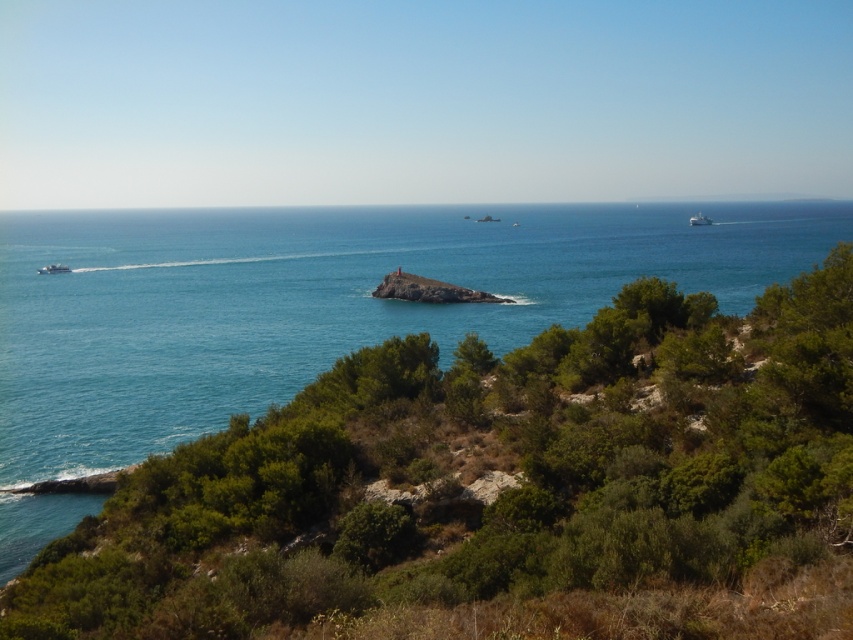
Between blue water at center and metallic silver boat at left, which one has less height?

metallic silver boat at left

Is blue water at center taller than metallic silver boat at left?

Yes.

Where is `blue water at center`? The height and width of the screenshot is (640, 853). blue water at center is located at coordinates (315, 301).

Is point (172, 234) closer to camera compared to point (699, 224)?

That is True.

Is blue water at center further to the viewer compared to white matte boat at upper right?

No, blue water at center is closer to the viewer.

At what (x,y) coordinates should I click in order to perform the action: click on blue water at center. Please return your answer as a coordinate pair (x, y). Looking at the image, I should click on (315, 301).

In order to click on blue water at center in this screenshot , I will do `click(315, 301)`.

Which is behind, point (42, 269) or point (700, 224)?

Positioned behind is point (700, 224).

Is metallic silver boat at left taller than white matte boat at upper right?

Incorrect, metallic silver boat at left's height is not larger of white matte boat at upper right's.

Locate an element on the screen. The width and height of the screenshot is (853, 640). metallic silver boat at left is located at coordinates (53, 268).

The image size is (853, 640). In order to click on metallic silver boat at left in this screenshot , I will do `click(53, 268)`.